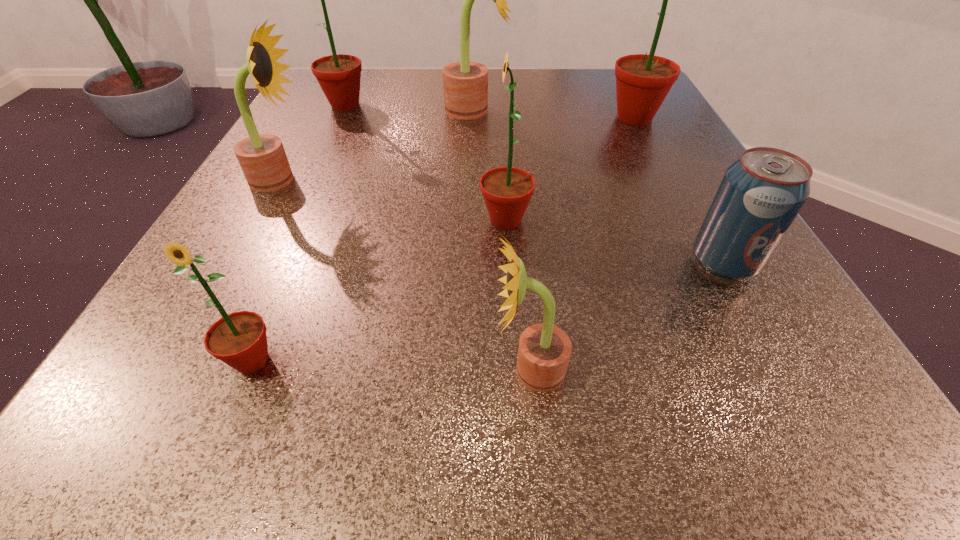
Locate an element on the screen. The height and width of the screenshot is (540, 960). object at the far right corner is located at coordinates (643, 81).

At what (x,y) coordinates should I click in order to perform the action: click on free space at the far edge of the desktop. Please return your answer as a coordinate pair (x, y). Image resolution: width=960 pixels, height=540 pixels. Looking at the image, I should click on (561, 111).

This screenshot has height=540, width=960. In order to click on vacant space at the near edge in this screenshot , I will do `click(653, 425)`.

The height and width of the screenshot is (540, 960). In the image, there is a desktop. Identify the location of free space at the left edge. (311, 148).

You are a GUI agent. You are given a task and a screenshot of the screen. Output one action in this format:
    pyautogui.click(x=<x>, y=<y>)
    Task: Click on the vacant space at the right edge of the desktop
    The width and height of the screenshot is (960, 540).
    Given the screenshot: What is the action you would take?
    pyautogui.click(x=786, y=297)

Image resolution: width=960 pixels, height=540 pixels. Find the location of `blank space at the far left corner of the desktop`. blank space at the far left corner of the desktop is located at coordinates (387, 68).

Locate an element on the screen. vacant space at the far right corner of the desktop is located at coordinates (582, 69).

This screenshot has width=960, height=540. I want to click on vacant area at the near right corner of the desktop, so click(747, 390).

Where is `vacant region between the biggest green sunflower and the fifth farthest sunflower`? This screenshot has height=540, width=960. vacant region between the biggest green sunflower and the fifth farthest sunflower is located at coordinates tap(570, 168).

This screenshot has height=540, width=960. Find the location of `free space between the smallest green sunflower and the second nearest yellow sunflower`. free space between the smallest green sunflower and the second nearest yellow sunflower is located at coordinates (267, 270).